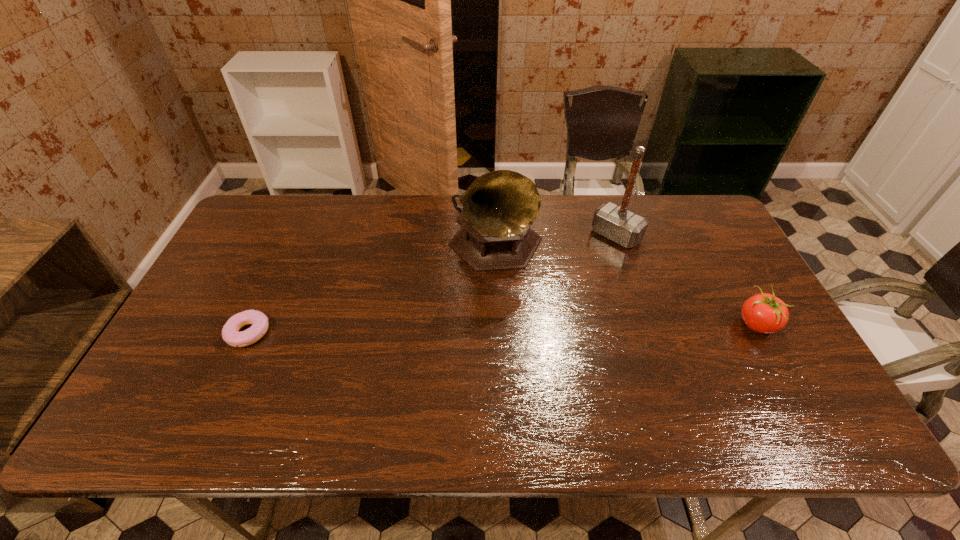
At what (x,y) coordinates should I click in order to perform the action: click on free space located 0.310m on the horn direction of the third object from right to left. Please return your answer as a coordinate pair (x, y). Looking at the image, I should click on (606, 358).

Identify the location of vacant area situated on the striking surface of the hammer. This screenshot has width=960, height=540. (582, 267).

Locate an element on the screen. vacant region located 0.100m on the striking surface of the hammer is located at coordinates (586, 263).

What are the coordinates of `vacant space located 0.300m on the striking surface of the hammer` in the screenshot? It's located at (545, 300).

This screenshot has width=960, height=540. I want to click on phonograph record located at the far edge, so click(499, 207).

This screenshot has width=960, height=540. What are the coordinates of `hammer present at the far edge` in the screenshot? It's located at (612, 221).

The image size is (960, 540). In order to click on object that is positioned at the left edge in this screenshot , I will do [259, 321].

Where is `object positioned at the right edge`? This screenshot has width=960, height=540. object positioned at the right edge is located at coordinates (764, 313).

The height and width of the screenshot is (540, 960). What are the coordinates of `vacant point at the far edge` in the screenshot? It's located at (407, 198).

Image resolution: width=960 pixels, height=540 pixels. Find the location of `vacant point at the near edge`. vacant point at the near edge is located at coordinates (416, 379).